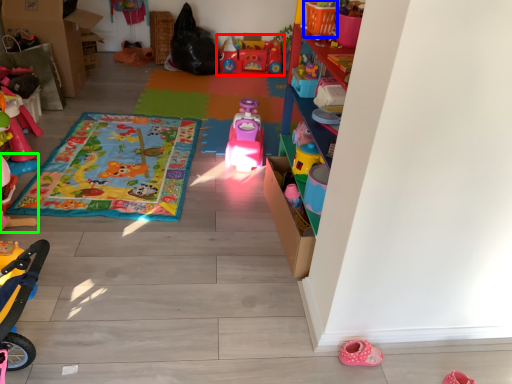
Question: Estimate the real-world distances between objects in this image. Which object is closer to toy (highlighted by a red box), toy (highlighted by a blue box) or toy (highlighted by a green box)?

Choices:
 (A) toy
 (B) toy

Answer: (A)